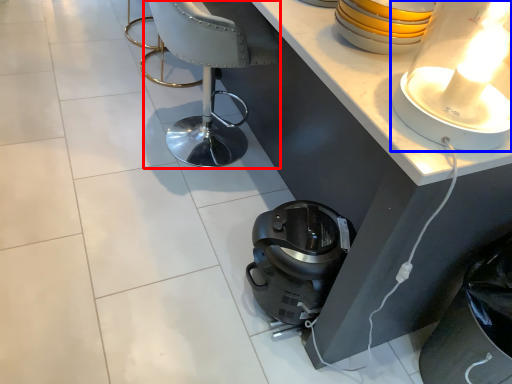
Question: Which object appears farthest to the camera in this image, armchair (highlighted by a red box) or lamp (highlighted by a blue box)?

Choices:
 (A) armchair
 (B) lamp

Answer: (A)